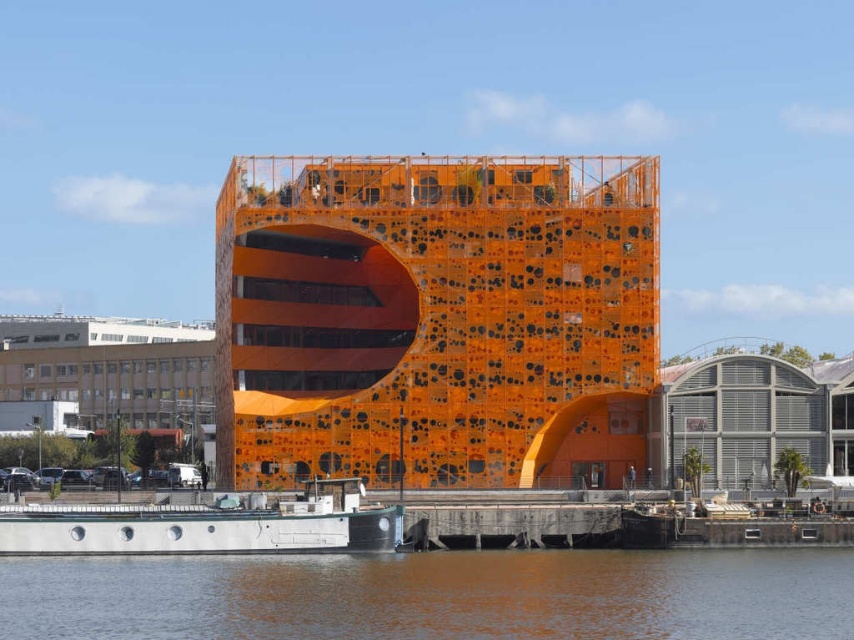
You are standing at a viewpoint 349.79 feet away from the orange building with black dots. The point where you want to place a new sculpture is located at coordinates point [370,388] on the building. Considering the distance, can you estimate how far you need to walk to reach that exact point on the building?

The point [370,388] is 349.79 feet away from the viewer, so you need to walk approximately 349.79 feet to reach that exact point on the building.

You are a drone operator planning to fly a drone over the brown water at lower center and the metallic gray warehouse at right. Which object will require the drone to fly higher to avoid collision?

The metallic gray warehouse at right is taller than the brown water at lower center, so the drone will need to fly higher to avoid collision with the metallic gray warehouse at right.

You are standing in front of the modern orange building with black dots. There are two points on the building labeled as point (219, 300) and point (727, 387). Which point is closer to you?

Point (219, 300) is closer to you because it is further to the viewer than point (727, 387).